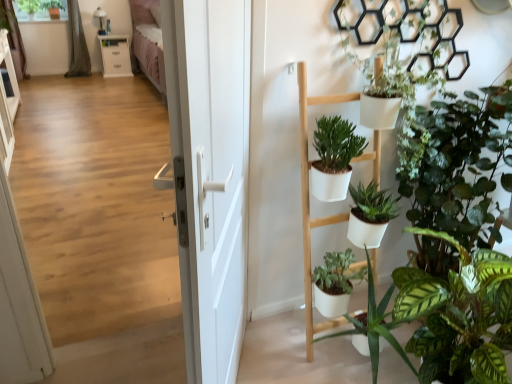
Locate an element on the screen. This screenshot has width=512, height=384. green matte plant at upper left, the 1th plant when ordered from right to left is located at coordinates (52, 6).

The image size is (512, 384). What are the coordinates of `white glossy cabinet at upper left` in the screenshot? It's located at (115, 55).

Locate an element on the screen. green matte plant at upper left, the 2th plant in the right-to-left sequence is located at coordinates (29, 6).

In order to face green matte plant at upper left, arranged as the first plant when viewed from the left, should I rotate leftwards or rightwards?

Turn left by 27.723 degrees to look at green matte plant at upper left, arranged as the first plant when viewed from the left.

Measure the distance between gray fabric curtain at upper left, which is the 1th curtain in right-to-left order, and camera.

5.91 meters.

You are a GUI agent. You are given a task and a screenshot of the screen. Output one action in this format:
    pyautogui.click(x=<x>, y=<y>)
    Task: Click on the white matte door at center
    The width and height of the screenshot is (512, 384).
    Given the screenshot: What is the action you would take?
    pyautogui.click(x=210, y=174)

What are the coordinates of `green matte plant at upper left, the 1th plant when ordered from right to left` in the screenshot? It's located at (52, 6).

Does green matte plant at upper left, the 2th plant in the right-to-left sequence, have a greater width compared to gray fabric curtain at upper left, the 2th curtain from the left?

Yes.

Looking at this image, which of these two, green matte plant at upper left, arranged as the first plant when viewed from the left, or gray fabric curtain at upper left, which is the 1th curtain in right-to-left order, is bigger?

Bigger between the two is gray fabric curtain at upper left, which is the 1th curtain in right-to-left order.

Is gray fabric curtain at upper left, which is the 1th curtain in right-to-left order, a part of green matte plant at upper left, the 2th plant in the right-to-left sequence?

No, gray fabric curtain at upper left, which is the 1th curtain in right-to-left order, is not a part of green matte plant at upper left, the 2th plant in the right-to-left sequence.

Relative to green matte plant at upper left, the 1th plant when ordered from right to left, is green fabric curtain at upper left, the 1th curtain viewed from the left, in front or behind?

Visually, green fabric curtain at upper left, the 1th curtain viewed from the left, is located in front of green matte plant at upper left, the 1th plant when ordered from right to left.

Are green fabric curtain at upper left, placed as the second curtain when sorted from right to left, and green matte plant at upper left, marked as the 2th plant in a left-to-right arrangement, located far from each other?

No, there isn't a large distance between green fabric curtain at upper left, placed as the second curtain when sorted from right to left, and green matte plant at upper left, marked as the 2th plant in a left-to-right arrangement.

Can you confirm if green fabric curtain at upper left, the 1th curtain viewed from the left, is shorter than green matte plant at upper left, marked as the 2th plant in a left-to-right arrangement?

No.

From a real-world perspective, which is physically below, wooden floor at center or green matte plant at upper left, the 1th plant when ordered from right to left?

In real-world perspective, wooden floor at center is lower.

Considering the points (62, 126) and (58, 2), which point is in front, point (62, 126) or point (58, 2)?

The point (62, 126) is closer.

What's the angular difference between wooden floor at center and green matte plant at upper left, the 1th plant when ordered from right to left,'s facing directions?

wooden floor at center and green matte plant at upper left, the 1th plant when ordered from right to left, are facing 178 degrees away from each other.

Based on the photo, are wooden floor at center and green matte plant at upper left, marked as the 2th plant in a left-to-right arrangement, beside each other?

No.

Considering the sizes of objects green fabric curtain at upper left, the 1th curtain viewed from the left, and wooden floor at center in the image provided, who is shorter, green fabric curtain at upper left, the 1th curtain viewed from the left, or wooden floor at center?

green fabric curtain at upper left, the 1th curtain viewed from the left, is shorter.

Find the location of a particular element. corridor located above the green fabric curtain at upper left, placed as the second curtain when sorted from right to left (from a real-world perspective) is located at coordinates (100, 227).

From the picture: Can you confirm if green fabric curtain at upper left, the 1th curtain viewed from the left, is wider than wooden floor at center?

Correct, the width of green fabric curtain at upper left, the 1th curtain viewed from the left, exceeds that of wooden floor at center.

Is wooden floor at center at the back of green fabric curtain at upper left, placed as the second curtain when sorted from right to left?

No.

Considering the sizes of green matte plant at upper left, marked as the 2th plant in a left-to-right arrangement, and green fabric curtain at upper left, placed as the second curtain when sorted from right to left, in the image, is green matte plant at upper left, marked as the 2th plant in a left-to-right arrangement, bigger or smaller than green fabric curtain at upper left, placed as the second curtain when sorted from right to left,?

Considering their sizes, green matte plant at upper left, marked as the 2th plant in a left-to-right arrangement, takes up less space than green fabric curtain at upper left, placed as the second curtain when sorted from right to left.

Is the depth of green matte plant at upper left, the 1th plant when ordered from right to left, greater than that of green fabric curtain at upper left, placed as the second curtain when sorted from right to left?

Yes, it is.

From a real-world perspective, starting from the green matte plant at upper left, the 1th plant when ordered from right to left, which curtain is the 2nd one below it? Please provide its 2D coordinates.

[(13, 37)]

Is white matte door at center positioned before green matte plant at upper left, arranged as the first plant when viewed from the left?

Yes, the depth of white matte door at center is less than that of green matte plant at upper left, arranged as the first plant when viewed from the left.

Is point (225, 228) farther from camera compared to point (27, 7)?

No, (225, 228) is in front of (27, 7).

From a real-world perspective, is white matte door at center on green matte plant at upper left, arranged as the first plant when viewed from the left?

No, from a real-world perspective, white matte door at center is not over green matte plant at upper left, arranged as the first plant when viewed from the left

From the image's perspective, is white matte door at center located above or below gray fabric curtain at upper left, the 2th curtain from the left?

white matte door at center is situated lower than gray fabric curtain at upper left, the 2th curtain from the left, in the image.

Considering the sizes of objects white matte door at center and gray fabric curtain at upper left, the 2th curtain from the left, in the image provided, who is wider, white matte door at center or gray fabric curtain at upper left, the 2th curtain from the left,?

gray fabric curtain at upper left, the 2th curtain from the left, is wider.

Considering the sizes of objects white matte door at center and gray fabric curtain at upper left, the 2th curtain from the left, in the image provided, who is bigger, white matte door at center or gray fabric curtain at upper left, the 2th curtain from the left,?

With larger size is white matte door at center.

From the picture: Measure the distance from white matte door at center to gray fabric curtain at upper left, the 2th curtain from the left.

white matte door at center and gray fabric curtain at upper left, the 2th curtain from the left, are 5.81 meters apart from each other.

At what (x,y) coordinates should I click in order to perform the action: click on curtain on the right side of green matte plant at upper left, arranged as the first plant when viewed from the left. Please return your answer as a coordinate pair (x, y). Image resolution: width=512 pixels, height=384 pixels. Looking at the image, I should click on (77, 43).

You are a GUI agent. You are given a task and a screenshot of the screen. Output one action in this format:
    pyautogui.click(x=<x>, y=<y>)
    Task: Click on the curtain that is the 2nd object directly below the green matte plant at upper left, marked as the 2th plant in a left-to-right arrangement (from a real-world perspective)
    
    Given the screenshot: What is the action you would take?
    pyautogui.click(x=13, y=37)

Consider the image. Considering their positions, is wooden floor at center positioned closer to white glossy cabinet at upper left than green matte plant at upper left, the 2th plant in the right-to-left sequence?

Based on the image, green matte plant at upper left, the 2th plant in the right-to-left sequence, appears to be nearer to white glossy cabinet at upper left.

Which object lies further to the anchor point wooden floor at center, white glossy cabinet at upper left or green fabric curtain at upper left, the 1th curtain viewed from the left?

white glossy cabinet at upper left.

Considering their positions, is green matte plant at upper left, the 1th plant when ordered from right to left, positioned further to wooden floor at center than green matte plant at upper left, arranged as the first plant when viewed from the left?

green matte plant at upper left, the 1th plant when ordered from right to left, is positioned further to the anchor wooden floor at center.

Based on their spatial positions, is gray fabric curtain at upper left, which is the 1th curtain in right-to-left order, or wooden floor at center further from green matte plant at upper left, marked as the 2th plant in a left-to-right arrangement?

wooden floor at center lies further to green matte plant at upper left, marked as the 2th plant in a left-to-right arrangement, than the other object.

When comparing their distances from white glossy cabinet at upper left, does green matte plant at upper left, marked as the 2th plant in a left-to-right arrangement, or green fabric curtain at upper left, placed as the second curtain when sorted from right to left, seem closer?

green matte plant at upper left, marked as the 2th plant in a left-to-right arrangement.

When comparing their distances from wooden floor at center, does green fabric curtain at upper left, the 1th curtain viewed from the left, or white matte door at center seem further?

green fabric curtain at upper left, the 1th curtain viewed from the left, lies further to wooden floor at center than the other object.

Estimate the real-world distances between objects in this image. Which object is further from white matte door at center, green matte plant at upper left, the 1th plant when ordered from right to left, or green fabric curtain at upper left, the 1th curtain viewed from the left?

The object further to white matte door at center is green matte plant at upper left, the 1th plant when ordered from right to left.

Which object lies further to the anchor point green fabric curtain at upper left, placed as the second curtain when sorted from right to left, white matte door at center or wooden floor at center?

white matte door at center lies further to green fabric curtain at upper left, placed as the second curtain when sorted from right to left, than the other object.

Identify the location of corridor between white matte door at center and white glossy cabinet at upper left along the z-axis. click(x=100, y=227).

The image size is (512, 384). Identify the location of plant between green matte plant at upper left, arranged as the first plant when viewed from the left, and white glossy cabinet at upper left from left to right. (52, 6).

This screenshot has width=512, height=384. I want to click on curtain positioned between wooden floor at center and gray fabric curtain at upper left, which is the 1th curtain in right-to-left order, from near to far, so click(x=13, y=37).

Locate an element on the screen. The width and height of the screenshot is (512, 384). plant between green matte plant at upper left, marked as the 2th plant in a left-to-right arrangement, and green fabric curtain at upper left, placed as the second curtain when sorted from right to left, vertically is located at coordinates (29, 6).